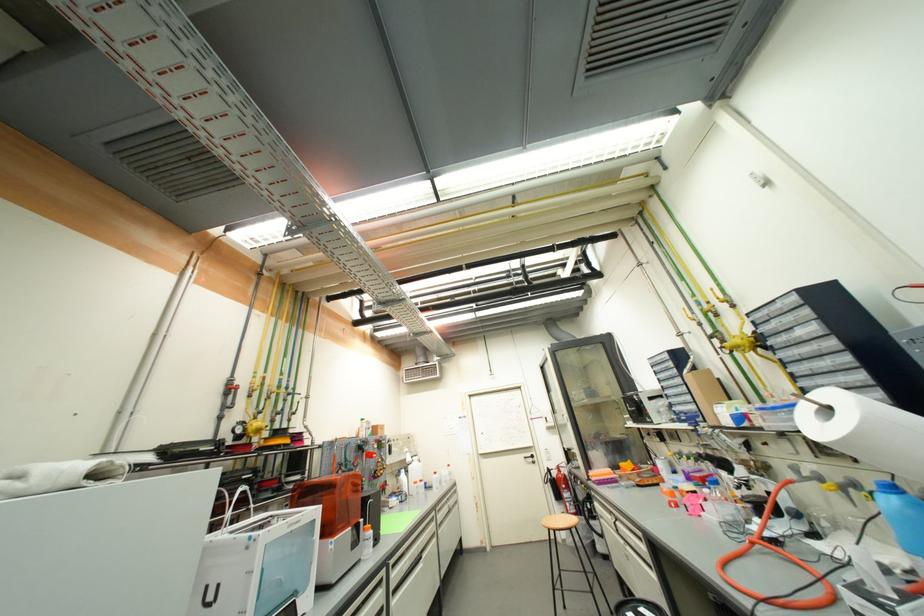
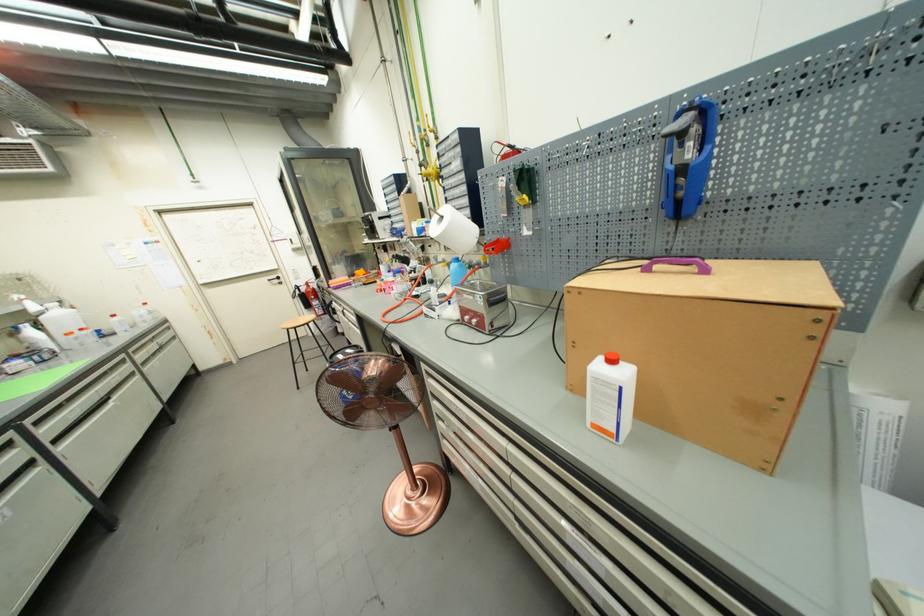
The point at (833, 410) is marked in the first image. Where is the corresponding point in the second image?

(447, 219)